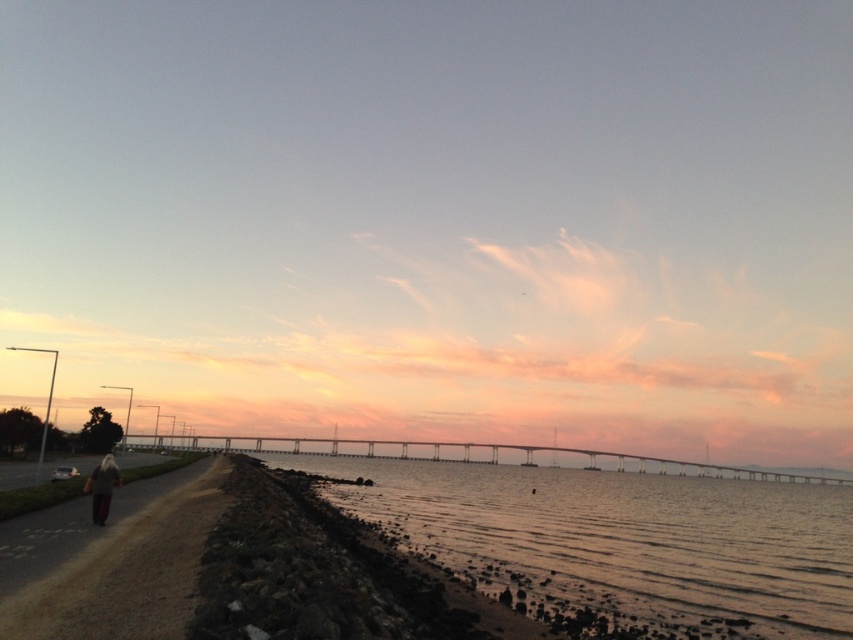
Question: From the image, what is the correct spatial relationship of dirt/gravel path at lower left in relation to dark gray fabric jacket at lower left?

Choices:
 (A) right
 (B) left

Answer: (A)

Question: Does sandy beach at lower center have a larger size compared to dark gray fabric jacket at lower left?

Choices:
 (A) yes
 (B) no

Answer: (A)

Question: Where is dirt/gravel path at lower left located in relation to dark gray fabric jacket at lower left in the image?

Choices:
 (A) below
 (B) above

Answer: (B)

Question: Among these objects, which one is farthest from the camera?

Choices:
 (A) sandy beach at lower center
 (B) dirt/gravel path at lower left

Answer: (A)

Question: Which of the following is the farthest from the observer?

Choices:
 (A) (683, 604)
 (B) (149, 548)
 (C) (108, 474)

Answer: (A)

Question: Which point is farther to the camera?

Choices:
 (A) dirt/gravel path at lower left
 (B) sandy beach at lower center

Answer: (B)